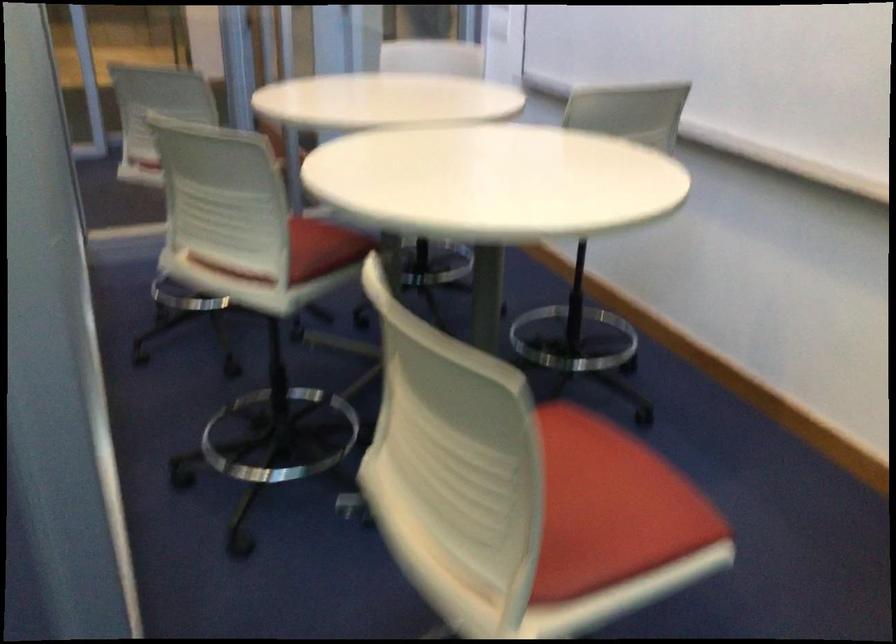
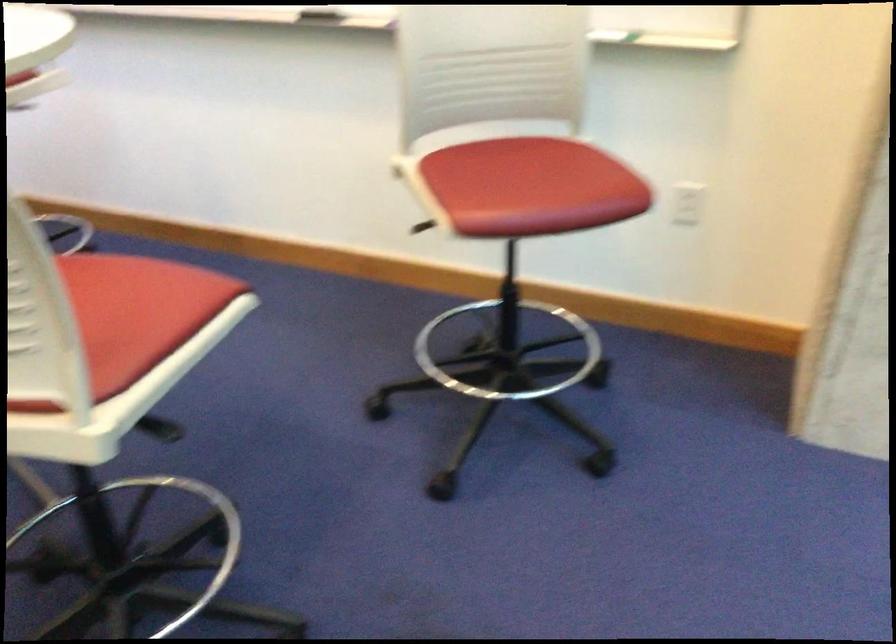
Question: Based on the continuous images, in which direction is the camera rotating? Reply with the corresponding letter.

Choices:
 (A) Left
 (B) Right
 (C) Up
 (D) Down

Answer: (B)